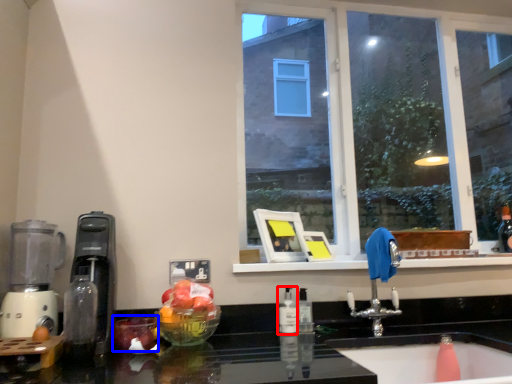
Question: Which point is further to the camera, bottle (highlighted by a red box) or apple (highlighted by a blue box)?

Choices:
 (A) bottle
 (B) apple

Answer: (A)